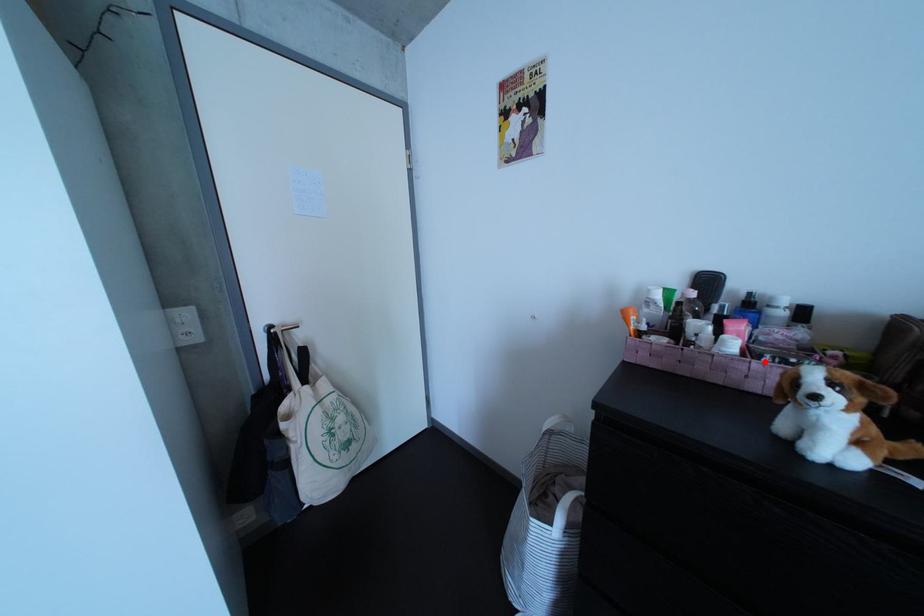
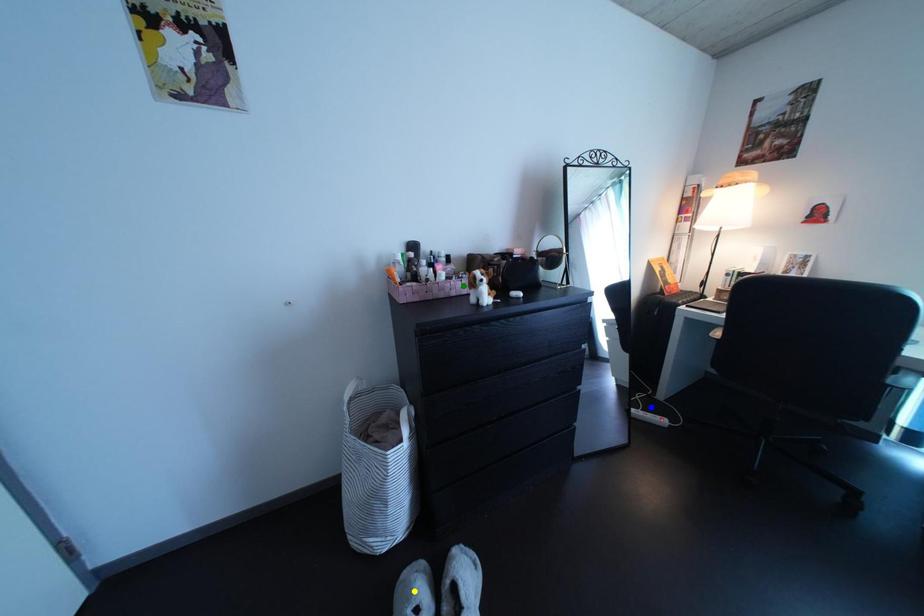
Question: I am providing you with two images of the same scene from different viewpoints. A red point is marked on the first image. You are given multiple points on the second image. Which mark in image 2 goes with the point in image 1?

Choices:
 (A) yellow point
 (B) green point
 (C) blue point

Answer: (B)